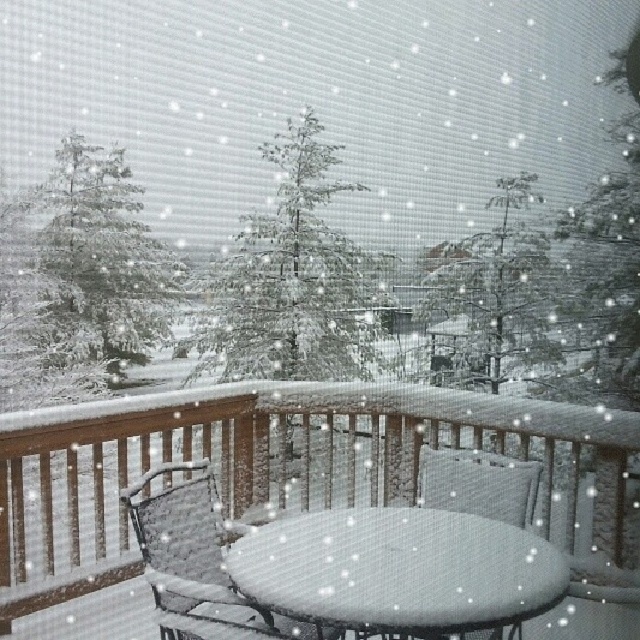
You are standing on the wooden deck and want to place a snow globe on the white textured table at center. Based on the coordinates provided, can you confirm if the point marked by point (397, 570) is the correct location for the table?

Yes, the point (397, 570) marks the white textured table at center, so placing the snow globe there would be accurate.

You are standing on the wooden deck and want to take a photo of the green textured evergreen tree at center. To ensure the tree is centered in your camera viewfinder, where should you aim your camera? Please provide coordinates based on the image grid system where the bottom left corner is the origin point.

The green textured evergreen tree at center is positioned at coordinates point (x=292, y=276), so you should aim your camera at those coordinates to center it in the viewfinder.